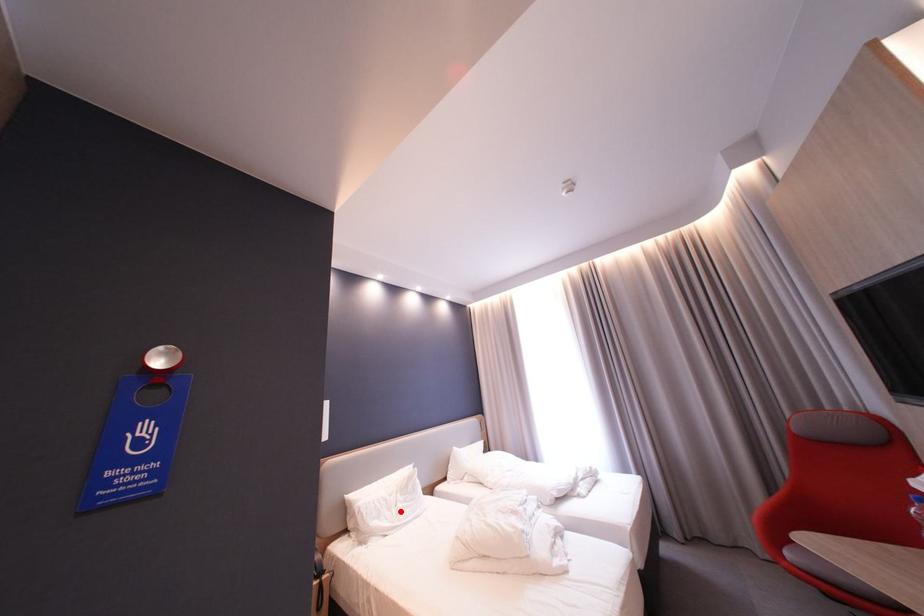
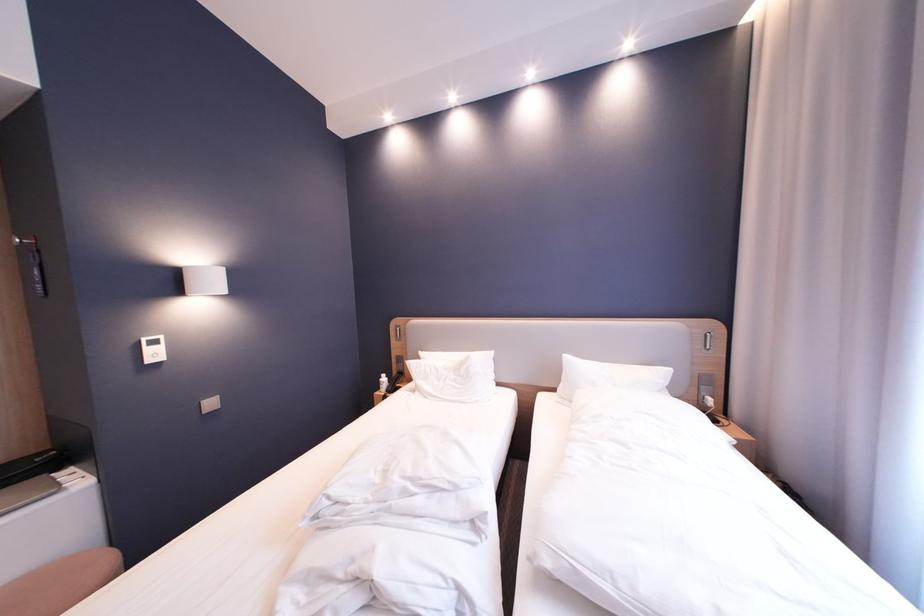
In the second image, find the point that corresponds to the highlighted location in the first image.

(450, 382)